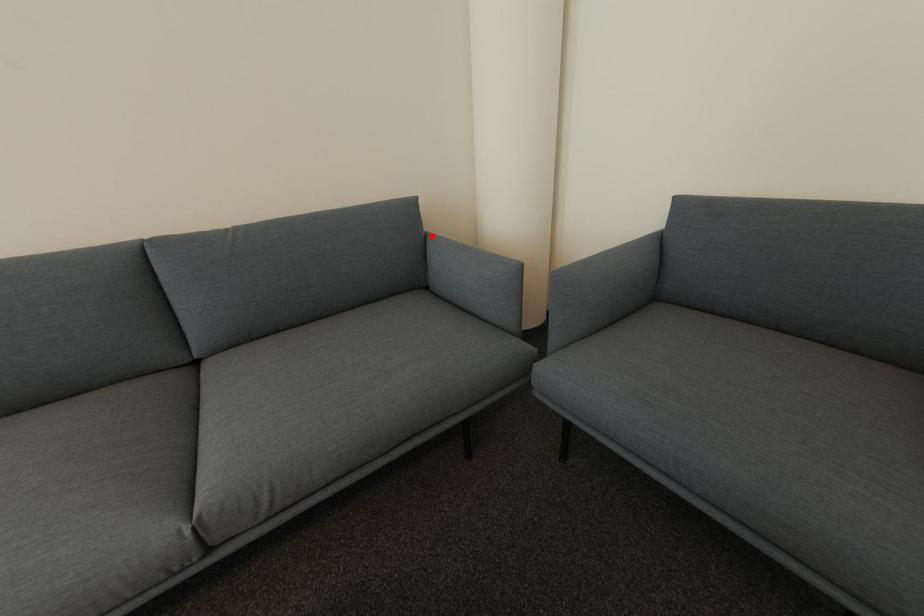
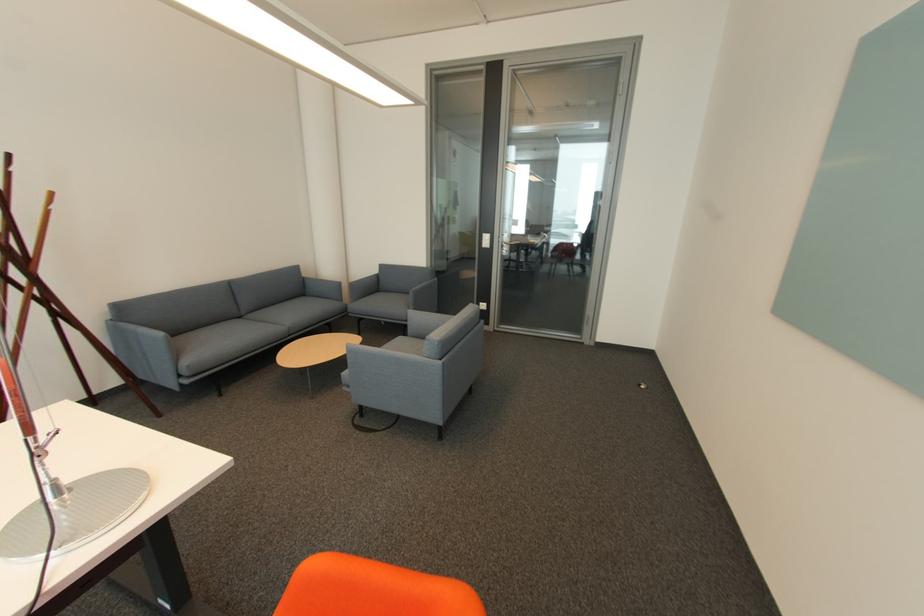
Find the pixel in the second image that matches the highlighted location in the first image.

(310, 278)